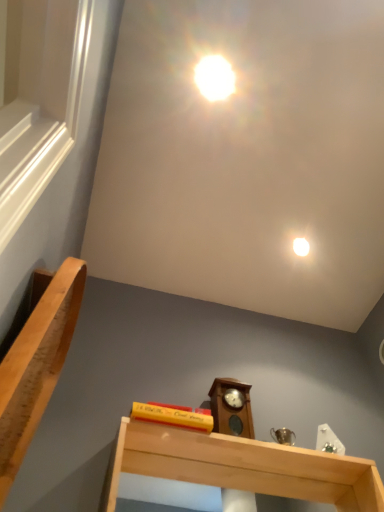
The height and width of the screenshot is (512, 384). What do you see at coordinates (36, 362) in the screenshot?
I see `light brown wood handrail at left` at bounding box center [36, 362].

Where is `white glossy droplight at upper center`? Image resolution: width=384 pixels, height=512 pixels. white glossy droplight at upper center is located at coordinates (301, 246).

From the image's perspective, is wooden grandfather clock at center on light brown wood handrail at left?

No, from the image's perspective, wooden grandfather clock at center is not over light brown wood handrail at left.

Is wooden grandfather clock at center looking in the opposite direction of light brown wood handrail at left?

wooden grandfather clock at center is not turned away from light brown wood handrail at left.

In the scene shown: Does wooden grandfather clock at center have a larger size compared to light brown wood handrail at left?

No.

The image size is (384, 512). In order to click on furniture in front of the wooden grandfather clock at center in this screenshot , I will do `click(36, 362)`.

Is light wood shelf at lower center at the right side of light brown wood handrail at left?

Yes, light wood shelf at lower center is to the right of light brown wood handrail at left.

Which is in front, point (210, 462) or point (70, 301)?

The point (70, 301) is more forward.

Is light wood shelf at lower center wider or thinner than light brown wood handrail at left?

Clearly, light wood shelf at lower center has more width compared to light brown wood handrail at left.

In the image, is white glossy droplight at upper center positioned in front of or behind wooden grandfather clock at center?

white glossy droplight at upper center is positioned farther from the viewer than wooden grandfather clock at center.

Looking at their sizes, would you say white glossy droplight at upper center is wider or thinner than wooden grandfather clock at center?

Considering their sizes, white glossy droplight at upper center looks slimmer than wooden grandfather clock at center.

Measure the distance between white glossy droplight at upper center and wooden grandfather clock at center.

28.65 inches.

Considering the relative positions of white glossy droplight at upper center and wooden grandfather clock at center in the image provided, is white glossy droplight at upper center to the left or to the right of wooden grandfather clock at center?

white glossy droplight at upper center is to the right of wooden grandfather clock at center.

Considering the positions of objects white glossy droplight at upper center and light brown wood handrail at left in the image provided, who is more to the left, white glossy droplight at upper center or light brown wood handrail at left?

From the viewer's perspective, light brown wood handrail at left appears more on the left side.

From the image's perspective, which one is positioned lower, white glossy droplight at upper center or light brown wood handrail at left?

light brown wood handrail at left.

You are a GUI agent. You are given a task and a screenshot of the screen. Output one action in this format:
    pyautogui.click(x=<x>, y=<y>)
    Task: Click on the furniture in front of the white glossy droplight at upper center
    
    Given the screenshot: What is the action you would take?
    pyautogui.click(x=36, y=362)

Is light brown wood handrail at left not near white glossy droplight at upper center?

Yes, light brown wood handrail at left and white glossy droplight at upper center are located far from each other.

Considering the sizes of objects light brown wood handrail at left and white glossy droplight at upper center in the image provided, who is shorter, light brown wood handrail at left or white glossy droplight at upper center?

white glossy droplight at upper center is shorter.

From a real-world perspective, between light brown wood handrail at left and white glossy droplight at upper center, who is vertically lower?

light brown wood handrail at left.

Are light brown wood handrail at left and wooden grandfather clock at center located far from each other?

No, light brown wood handrail at left is not far away from wooden grandfather clock at center.

Where is `alarm clock above the light brown wood handrail at left (from a real-world perspective)`? This screenshot has width=384, height=512. alarm clock above the light brown wood handrail at left (from a real-world perspective) is located at coordinates (231, 409).

From the image's perspective, would you say light brown wood handrail at left is positioned over wooden grandfather clock at center?

Yes, from the image's perspective, light brown wood handrail at left is over wooden grandfather clock at center.

What's the angular difference between light brown wood handrail at left and wooden grandfather clock at center's facing directions?

89.6 degrees separate the facing orientations of light brown wood handrail at left and wooden grandfather clock at center.

Which object is closer to the camera, wooden grandfather clock at center or white glossy droplight at upper center?

wooden grandfather clock at center.

What's the angular difference between wooden grandfather clock at center and white glossy droplight at upper center's facing directions?

They differ by 89.6 degrees in their facing directions.

Does point (225, 422) come farther from viewer compared to point (302, 244)?

No, (225, 422) is in front of (302, 244).

Could you tell me if wooden grandfather clock at center is facing white glossy droplight at upper center?

No.

This screenshot has height=512, width=384. In order to click on furniture directly beneath the wooden grandfather clock at center (from a real-world perspective) in this screenshot , I will do `click(36, 362)`.

Identify the location of shelf located below the light brown wood handrail at left (from the image's perspective). (242, 466).

From the image, which object appears to be farther from light wood shelf at lower center, white glossy droplight at upper center or wooden grandfather clock at center?

white glossy droplight at upper center.

Which object lies further to the anchor point wooden grandfather clock at center, white glossy droplight at upper center or light brown wood handrail at left?

Among the two, white glossy droplight at upper center is located further to wooden grandfather clock at center.

From the image, which object appears to be nearer to white glossy droplight at upper center, light wood shelf at lower center or wooden grandfather clock at center?

wooden grandfather clock at center lies closer to white glossy droplight at upper center than the other object.

Estimate the real-world distances between objects in this image. Which object is closer to light brown wood handrail at left, light wood shelf at lower center or white glossy droplight at upper center?

light wood shelf at lower center.

From the image, which object appears to be nearer to white glossy droplight at upper center, light wood shelf at lower center or light brown wood handrail at left?

light wood shelf at lower center.

Looking at the image, which one is located further to light wood shelf at lower center, white glossy droplight at upper center or light brown wood handrail at left?

white glossy droplight at upper center lies further to light wood shelf at lower center than the other object.

Considering their positions, is light wood shelf at lower center positioned further to light brown wood handrail at left than wooden grandfather clock at center?

Based on the image, wooden grandfather clock at center appears to be further to light brown wood handrail at left.

Estimate the real-world distances between objects in this image. Which object is further from light wood shelf at lower center, light brown wood handrail at left or white glossy droplight at upper center?

white glossy droplight at upper center is further to light wood shelf at lower center.

Locate an element on the screen. Image resolution: width=384 pixels, height=512 pixels. alarm clock located between light wood shelf at lower center and white glossy droplight at upper center in the depth direction is located at coordinates (231, 409).

Locate an element on the screen. This screenshot has width=384, height=512. shelf between light brown wood handrail at left and wooden grandfather clock at center in the front-back direction is located at coordinates (242, 466).

You are a GUI agent. You are given a task and a screenshot of the screen. Output one action in this format:
    pyautogui.click(x=<x>, y=<y>)
    Task: Click on the alarm clock between light brown wood handrail at left and white glossy droplight at upper center from front to back
    This screenshot has height=512, width=384.
    Given the screenshot: What is the action you would take?
    pyautogui.click(x=231, y=409)

Where is `shelf between light brown wood handrail at left and white glossy droplight at upper center from front to back`? shelf between light brown wood handrail at left and white glossy droplight at upper center from front to back is located at coordinates (242, 466).